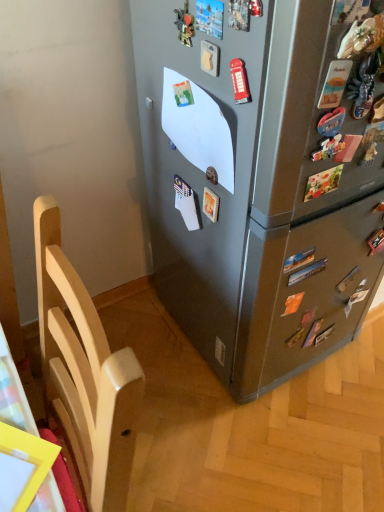
Image resolution: width=384 pixels, height=512 pixels. I want to click on vacant area that lies in front of satin gray refrigerator at center, so click(263, 434).